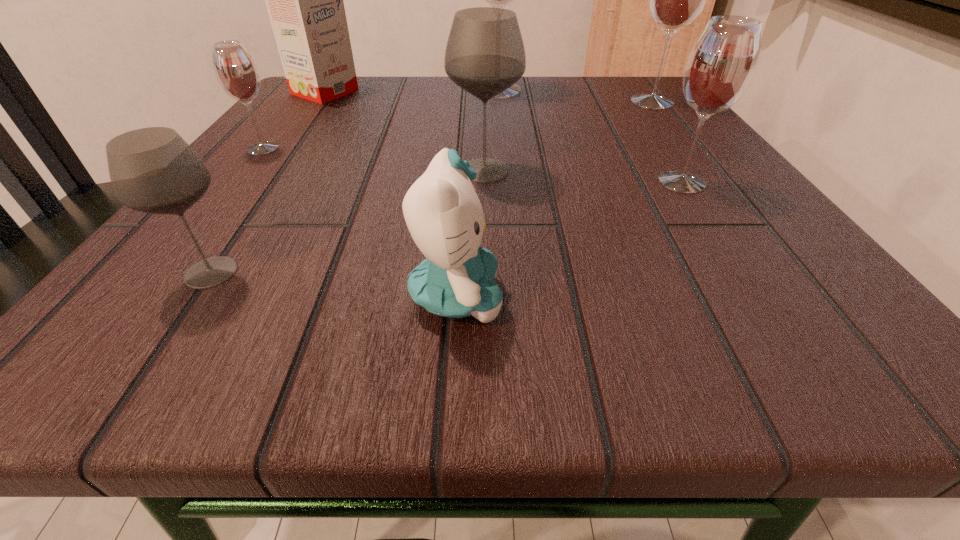
What are the coordinates of `vacant space that's between the carton and the bigger gray wineglass` in the screenshot? It's located at (404, 131).

Where is `object that is the fifth closest one to the carton`? Image resolution: width=960 pixels, height=540 pixels. object that is the fifth closest one to the carton is located at coordinates (445, 218).

Select which object appears as the fifth closest to the leftmost red wineglass. Please provide its 2D coordinates. Your answer should be formatted as a tuple, i.e. [(x, y)], where the tuple contains the x and y coordinates of a point satisfying the conditions above.

[(445, 218)]

The width and height of the screenshot is (960, 540). Identify the location of the fifth closest wineglass to the third smallest red wineglass. (153, 170).

Where is `wineglass object that ranks as the third closest to the second red wineglass from left to right`? The width and height of the screenshot is (960, 540). wineglass object that ranks as the third closest to the second red wineglass from left to right is located at coordinates (721, 65).

I want to click on red wineglass that is the second nearest to the carton, so click(499, 0).

I want to click on red wineglass that is the closest to the left gray wineglass, so click(236, 72).

The width and height of the screenshot is (960, 540). I want to click on vacant region that satisfies the following two spatial constraints: 1. on the front side of the bigger gray wineglass; 2. on the right side of the carton, so click(268, 171).

I want to click on vacant region that satisfies the following two spatial constraints: 1. on the front side of the nearest red wineglass; 2. on the face of the kitten, so click(757, 297).